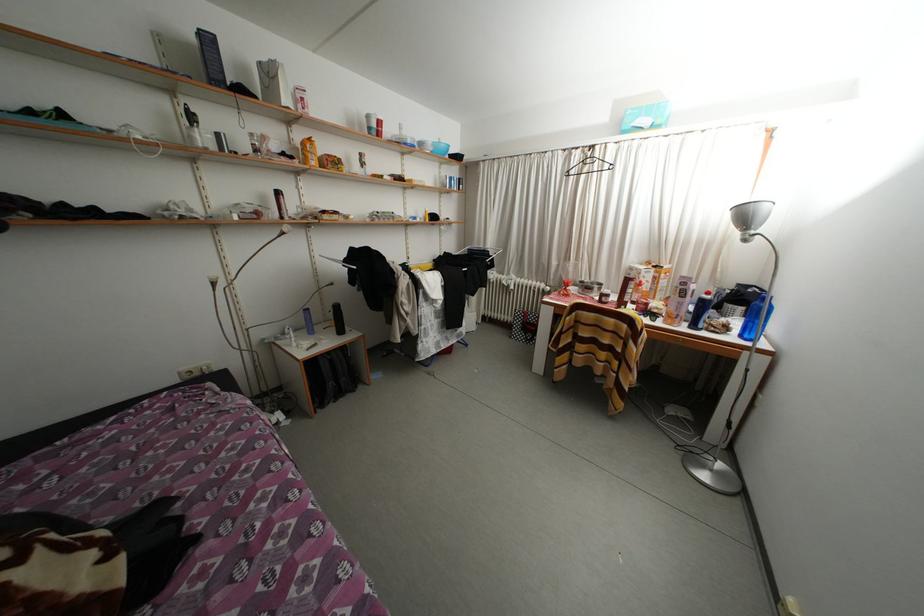
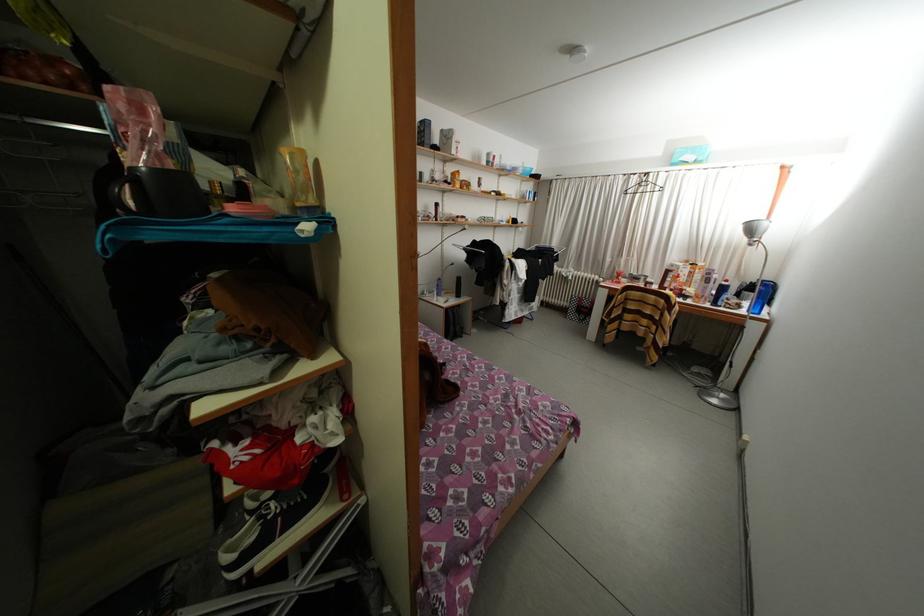
Question: I am providing you with two images of the same scene from different viewpoints. After the viewpoint changes to image2, which objects are now occluded?

Choices:
 (A) silver lamp head
 (B) blue water bottle
 (C) red bowl
 (D) none of these

Answer: (D)